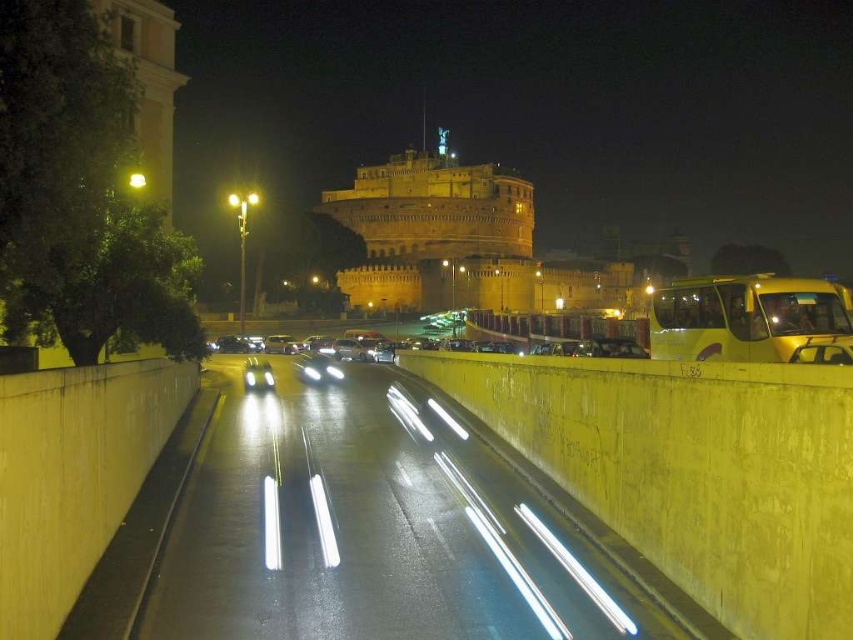
You are a delivery driver approaching the yellow concrete highway at center. You see the yellow matte bus at right ahead. Can you safely pass the bus if your truck requires 30 meters to change lanes?

The distance between the yellow concrete highway at center and the yellow matte bus at right is 25.08 meters. Since your truck needs 30 meters to change lanes, you do not have enough space and should not attempt to pass.

You are a delivery driver who needs to park your yellow matte bus at right on the yellow concrete highway at center. Considering the width of both, will the bus fit entirely on the highway without crossing the lane lines?

The yellow concrete highway at center might be wider than yellow matte bus at right, so there is a possibility that the bus can fit without crossing the lane lines, but it depends on the exact width difference.

You are a photographer trying to capture the castle in the background. You notice the yellow concrete highway at center and the yellow matte bus at right in your current frame. Which object should you adjust your camera angle to focus on the castle while avoiding the taller one?

The yellow concrete highway at center is taller than the yellow matte bus at right, so you should adjust your camera angle to avoid the yellow concrete highway at center to focus on the castle.